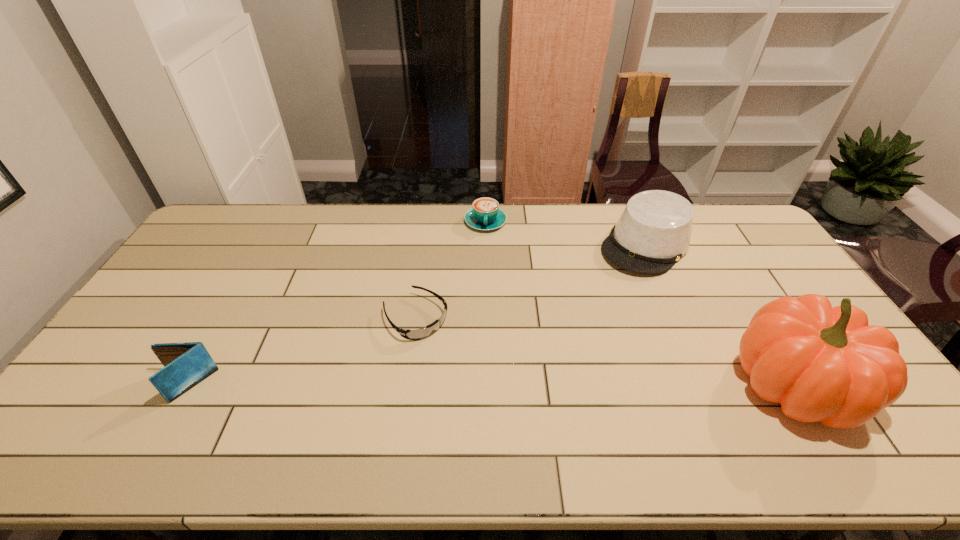
The width and height of the screenshot is (960, 540). In the image, there is a desktop. In order to click on vacant space at the far left corner in this screenshot , I will do pos(249,218).

In order to click on vacant space at the near left corner of the desktop in this screenshot , I will do `click(82, 393)`.

The height and width of the screenshot is (540, 960). What are the coordinates of `unoccupied position between the shortest object and the pumpkin` in the screenshot? It's located at (606, 351).

I want to click on free space between the shortest object and the second tallest object, so click(531, 281).

Find the location of a particular element. The width and height of the screenshot is (960, 540). free space between the wallet and the cappuccino is located at coordinates (335, 303).

Find the location of a particular element. free area in between the third object from left to right and the hat is located at coordinates (565, 233).

Image resolution: width=960 pixels, height=540 pixels. I want to click on free spot between the cappuccino and the leftmost object, so click(335, 303).

Locate an element on the screen. Image resolution: width=960 pixels, height=540 pixels. empty space that is in between the cappuccino and the pumpkin is located at coordinates (641, 303).

The height and width of the screenshot is (540, 960). I want to click on free spot between the third tallest object and the sunglasses, so click(x=300, y=352).

Find the location of a particular element. Image resolution: width=960 pixels, height=540 pixels. blank region between the second shortest object and the hat is located at coordinates (565, 233).